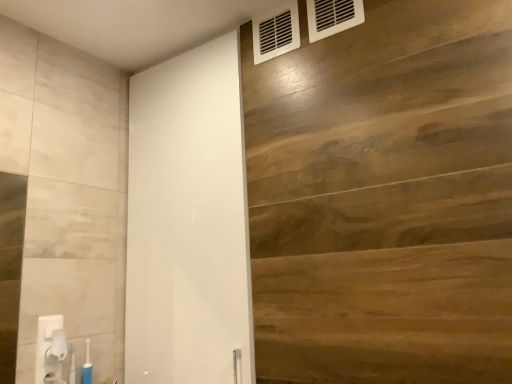
Question: From the image's perspective, is white plastic vent at upper right, the 1th air conditioning when ordered from back to front, above or below white plastic towel bar at lower left?

Choices:
 (A) above
 (B) below

Answer: (A)

Question: Is white plastic vent at upper right, the 1th air conditioning when ordered from back to front, inside or outside of white plastic towel bar at lower left?

Choices:
 (A) outside
 (B) inside

Answer: (A)

Question: Which of these objects is positioned closest to the translucent plastic toothbrush at lower left?

Choices:
 (A) white glossy barn door at center
 (B) wooden panel at upper right
 (C) blue plastic toothbrush at lower left
 (D) white plastic towel bar at lower left
 (E) white plastic air conditioning at upper right, which is counted as the 2th air conditioning, starting from the back

Answer: (C)

Question: Which of these objects is positioned closest to the white plastic air conditioning at upper right, acting as the 2th air conditioning starting from the left?

Choices:
 (A) white glossy barn door at center
 (B) white plastic towel bar at lower left
 (C) translucent plastic toothbrush at lower left
 (D) white plastic vent at upper right, the 1th air conditioning when ordered from back to front
 (E) wooden panel at upper right

Answer: (D)